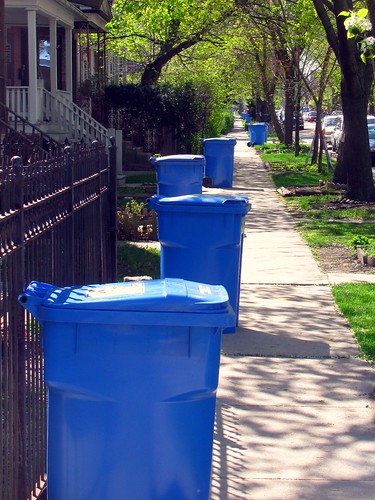
Identify the location of trashcans. This screenshot has height=500, width=375. (72, 370), (187, 231), (188, 183), (212, 150), (258, 133), (269, 124), (246, 115).